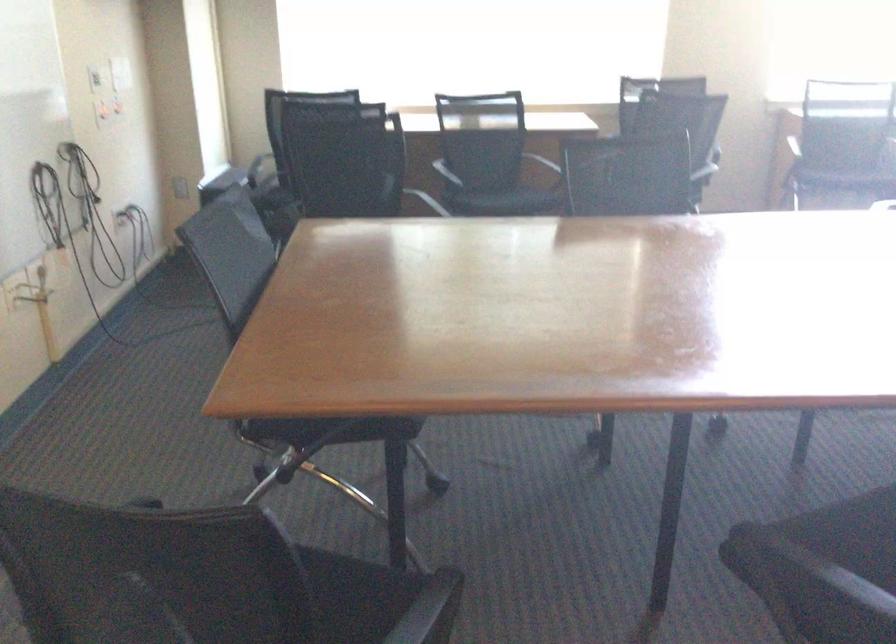
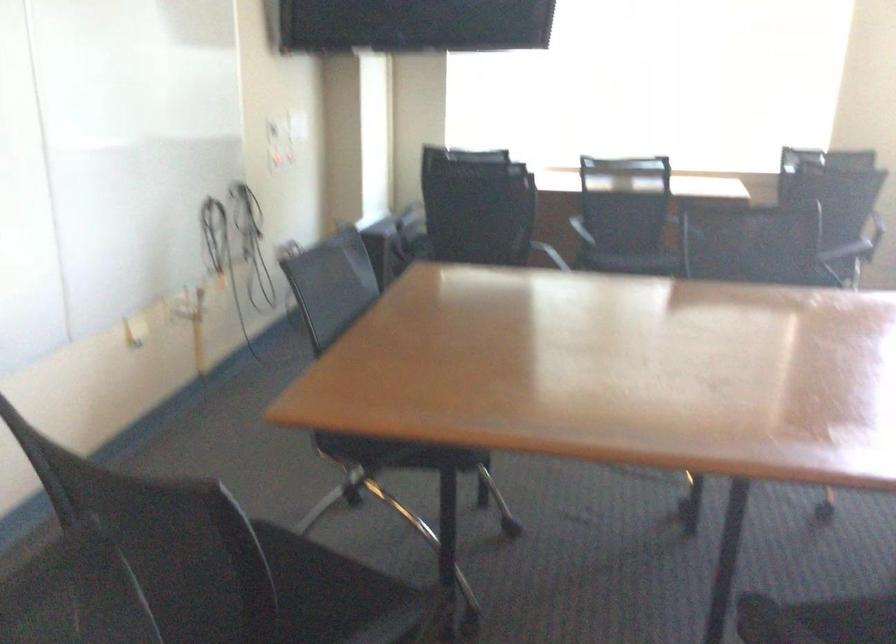
In the second image, find the point that corresponds to (337,428) in the first image.

(400, 453)